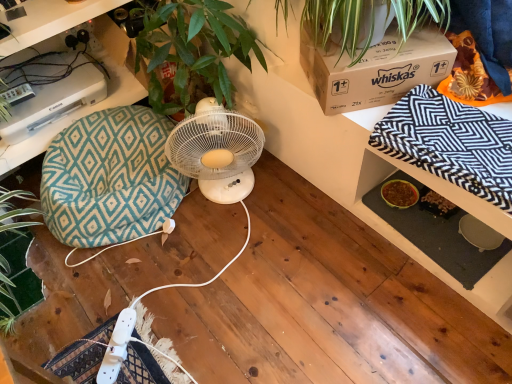
Question: Is white plastic fan at center not inside teal diamond-patterned bean bag chair at left?

Choices:
 (A) yes
 (B) no

Answer: (A)

Question: From a real-world perspective, is white plastic fan at center located beneath teal diamond-patterned bean bag chair at left?

Choices:
 (A) no
 (B) yes

Answer: (A)

Question: From the image's perspective, is white plastic fan at center on top of teal diamond-patterned bean bag chair at left?

Choices:
 (A) no
 (B) yes

Answer: (B)

Question: Is white plastic fan at center at the right side of teal diamond-patterned bean bag chair at left?

Choices:
 (A) no
 (B) yes

Answer: (B)

Question: Does white plastic fan at center have a greater height compared to teal diamond-patterned bean bag chair at left?

Choices:
 (A) yes
 (B) no

Answer: (A)

Question: From the image's perspective, is white plastic fan at center beneath teal diamond-patterned bean bag chair at left?

Choices:
 (A) yes
 (B) no

Answer: (B)

Question: Would you say brown cardboard box at upper right is part of teal diamond-patterned bean bag chair at left's contents?

Choices:
 (A) no
 (B) yes

Answer: (A)

Question: From the image's perspective, is teal diamond-patterned bean bag chair at left located above brown cardboard box at upper right?

Choices:
 (A) yes
 (B) no

Answer: (B)

Question: Can you confirm if teal diamond-patterned bean bag chair at left is taller than brown cardboard box at upper right?

Choices:
 (A) no
 (B) yes

Answer: (B)

Question: Does teal diamond-patterned bean bag chair at left appear on the left side of brown cardboard box at upper right?

Choices:
 (A) no
 (B) yes

Answer: (B)

Question: From the image's perspective, is teal diamond-patterned bean bag chair at left located beneath brown cardboard box at upper right?

Choices:
 (A) no
 (B) yes

Answer: (B)

Question: Is teal diamond-patterned bean bag chair at left outside of brown cardboard box at upper right?

Choices:
 (A) yes
 (B) no

Answer: (A)

Question: Does teal diamond-patterned bean bag chair at left appear on the right side of teal fabric cushion at left?

Choices:
 (A) no
 (B) yes

Answer: (B)